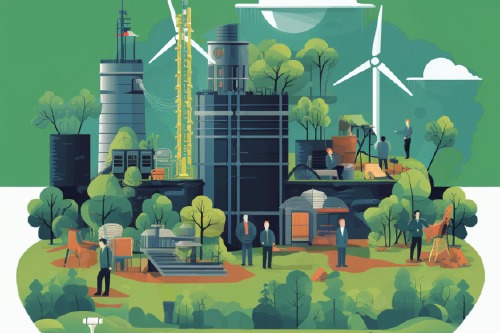
You are a GUI agent. You are given a task and a screenshot of the screen. Output one action in this format:
    pyautogui.click(x=<x>, y=<y>)
    Task: Click on the wooden easel
    The width and height of the screenshot is (500, 333).
    Given the screenshot: What is the action you would take?
    (435, 239)